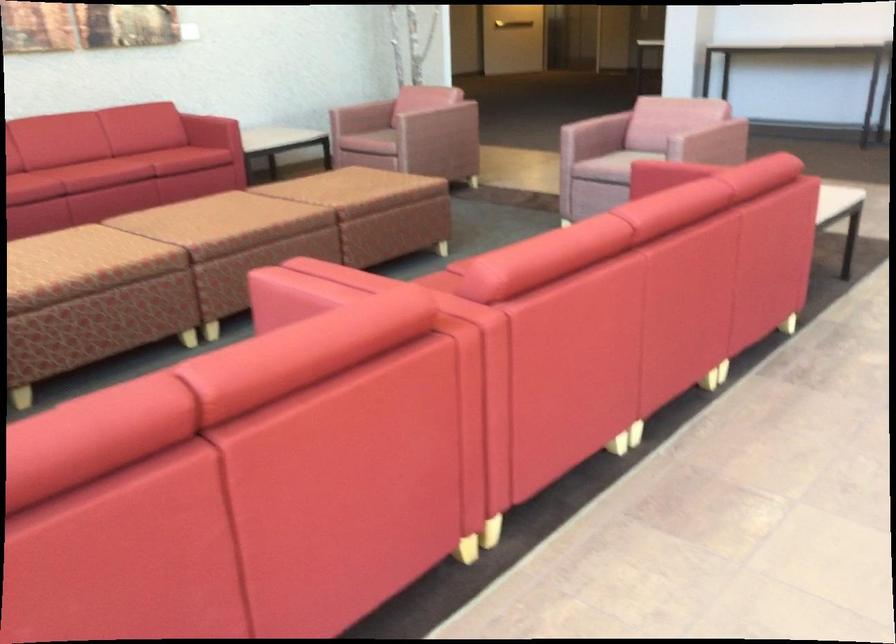
Where is `red sofa sitting surface`? The height and width of the screenshot is (644, 896). red sofa sitting surface is located at coordinates (142, 162).